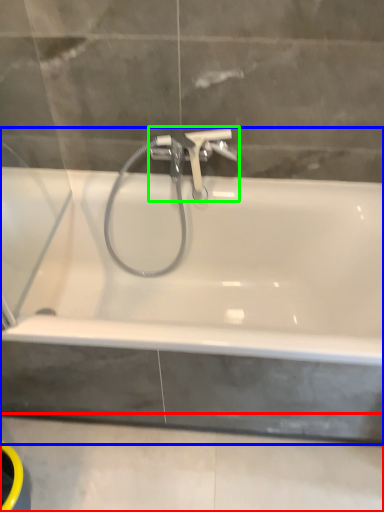
Question: Based on their relative distances, which object is farther from concrete (highlighted by a red box)? Choose from bathtub (highlighted by a blue box) and tap (highlighted by a green box).

Choices:
 (A) bathtub
 (B) tap

Answer: (B)